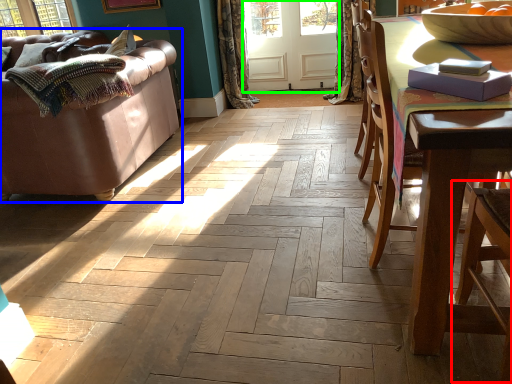
Question: Which is farther away from armchair (highlighted by a red box)? studio couch (highlighted by a blue box) or screen door (highlighted by a green box)?

Choices:
 (A) studio couch
 (B) screen door

Answer: (B)